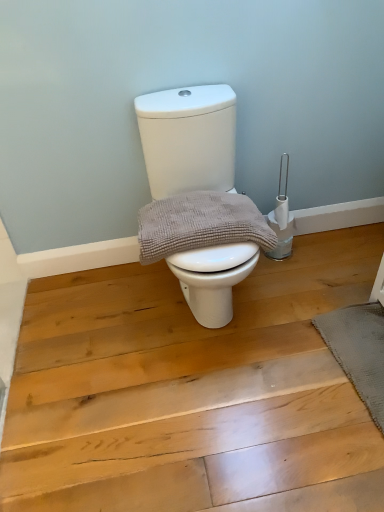
The width and height of the screenshot is (384, 512). Describe the element at coordinates (200, 224) in the screenshot. I see `gray textured towel at center` at that location.

Identify the location of gray textured towel at center. (200, 224).

Locate an element on the screen. This screenshot has height=512, width=384. material above the white glossy toilet at center (from a real-world perspective) is located at coordinates click(x=200, y=224).

Considering the relative positions of white glossy toilet at center and gray textured towel at center in the image provided, is white glossy toilet at center to the left of gray textured towel at center from the viewer's perspective?

No, white glossy toilet at center is not to the left of gray textured towel at center.

Is gray textured towel at center completely or partially inside white glossy toilet at center?

Yes, gray textured towel at center is a part of white glossy toilet at center.

Is gray textured towel at center at the back of white glossy toilet at center?

Yes, white glossy toilet at center is positioned with its back facing gray textured towel at center.

Between gray textured bath mat at lower right and gray textured towel at center, which one is positioned in front?

gray textured bath mat at lower right is in front.

From the image's perspective, is gray textured bath mat at lower right beneath gray textured towel at center?

Yes, from the image's perspective, gray textured bath mat at lower right is beneath gray textured towel at center.

Considering the positions of point (338, 339) and point (161, 256), is point (338, 339) closer or farther from the camera than point (161, 256)?

Point (338, 339) appears to be farther away from the viewer than point (161, 256).

Is white glossy toilet at center smaller than gray textured bath mat at lower right?

No.

Between white glossy toilet at center and gray textured bath mat at lower right, which one has smaller width?

gray textured bath mat at lower right is thinner.

Considering the relative positions of white glossy toilet at center and gray textured bath mat at lower right in the image provided, is white glossy toilet at center to the right of gray textured bath mat at lower right from the viewer's perspective?

No, white glossy toilet at center is not to the right of gray textured bath mat at lower right.

Considering the positions of objects gray textured bath mat at lower right and white glossy toilet at center in the image provided, who is more to the left, gray textured bath mat at lower right or white glossy toilet at center?

Positioned to the left is white glossy toilet at center.

From a real-world perspective, does gray textured bath mat at lower right stand above white glossy toilet at center?

Actually, gray textured bath mat at lower right is physically below white glossy toilet at center in the real world.

From the image's perspective, is gray textured bath mat at lower right beneath white glossy toilet at center?

Yes, from the image's perspective, gray textured bath mat at lower right is below white glossy toilet at center.

From the image's perspective, is gray textured towel at center located beneath white glossy toilet at center?

Yes.

Choose the correct answer: Is gray textured towel at center inside white glossy toilet at center or outside it?

gray textured towel at center can be found inside white glossy toilet at center.

Between gray textured towel at center and white glossy toilet at center, which one is positioned behind?

gray textured towel at center is behind.

Looking at this image, is gray textured towel at center smaller than white glossy toilet at center?

Yes.

Is gray textured towel at center taller than gray textured bath mat at lower right?

Yes, gray textured towel at center is taller than gray textured bath mat at lower right.

Which object is wider, gray textured towel at center or gray textured bath mat at lower right?

gray textured towel at center is wider.

Is gray textured towel at center aimed at gray textured bath mat at lower right?

No, gray textured towel at center does not turn towards gray textured bath mat at lower right.

From the image's perspective, which object appears higher, gray textured towel at center or gray textured bath mat at lower right?

From the image's view, gray textured towel at center is above.

Locate an element on the screen. This screenshot has height=512, width=384. toilet in front of the gray textured towel at center is located at coordinates coord(188,139).

I want to click on material that appears above the gray textured bath mat at lower right (from a real-world perspective), so click(x=200, y=224).

Looking at this image, which object lies further to the anchor point white glossy toilet at center, gray textured towel at center or gray textured bath mat at lower right?

Based on the image, gray textured bath mat at lower right appears to be further to white glossy toilet at center.

Which object lies further to the anchor point gray textured bath mat at lower right, gray textured towel at center or white glossy toilet at center?

white glossy toilet at center is positioned further to the anchor gray textured bath mat at lower right.

Which object lies further to the anchor point white glossy toilet at center, gray textured bath mat at lower right or gray textured towel at center?

gray textured bath mat at lower right is positioned further to the anchor white glossy toilet at center.

Estimate the real-world distances between objects in this image. Which object is closer to gray textured towel at center, gray textured bath mat at lower right or white glossy toilet at center?

Among the two, white glossy toilet at center is located nearer to gray textured towel at center.

Considering their positions, is white glossy toilet at center positioned further to gray textured towel at center than gray textured bath mat at lower right?

gray textured bath mat at lower right.

Based on their spatial positions, is white glossy toilet at center or gray textured towel at center closer to gray textured bath mat at lower right?

The object closer to gray textured bath mat at lower right is gray textured towel at center.

Where is `toilet between gray textured towel at center and gray textured bath mat at lower right`? The height and width of the screenshot is (512, 384). toilet between gray textured towel at center and gray textured bath mat at lower right is located at coordinates (188, 139).